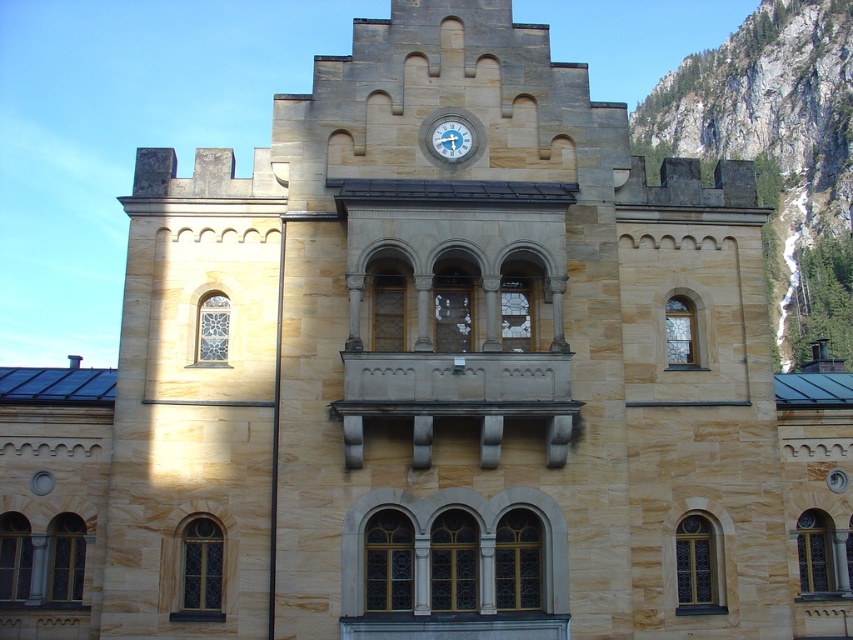
Is the position of rocky cliff at upper right more distant than that of metallic gray clock at upper center?

That is True.

Measure the distance between point (795, 6) and camera.

Point (795, 6) and camera are 249.33 meters apart from each other.

The width and height of the screenshot is (853, 640). What are the coordinates of `rocky cliff at upper right` in the screenshot? It's located at (776, 152).